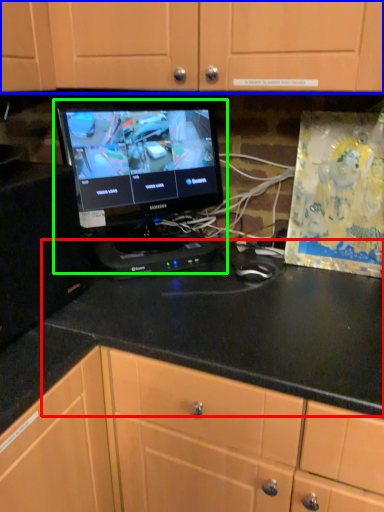
Question: Which is farther away from counter top (highlighted by a red box)? cabinetry (highlighted by a blue box) or computer monitor (highlighted by a green box)?

Choices:
 (A) cabinetry
 (B) computer monitor

Answer: (A)